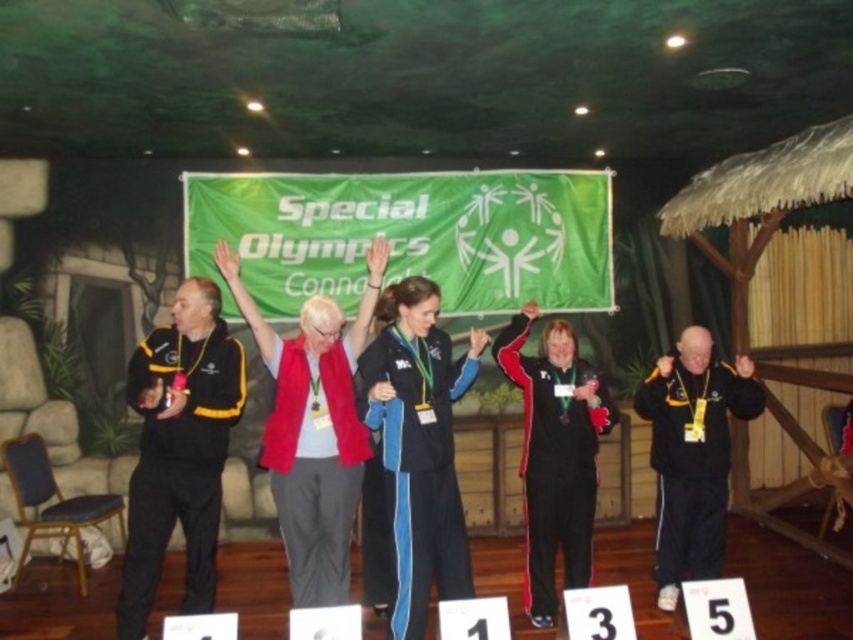
You are a photographer standing at the center of the stage. You need to take a photo of the black fabric jacket at left. Based on its position, where should you aim your camera?

The black fabric jacket at left is located at point 0.705 on the x axis and 0.211 on the y axis, so you should aim your camera towards the left side of the stage at those coordinates to capture it.

You are a photographer taking a photo of the stage for the event. You need to ensure that both the black fabric jacket at left and the blue track suit at center are visible in the frame. Based on their positions, which one is closer to the bottom of the photo?

The black fabric jacket at left is positioned under the blue track suit at center, so it is closer to the bottom of the photo.

You are a photographer at the event and need to capture a photo of both the black track suit at center and the black matte jacket at right. Based on their positions, which one is higher up in the frame?

The black track suit at center is above the black matte jacket at right, so it is higher up in the frame.